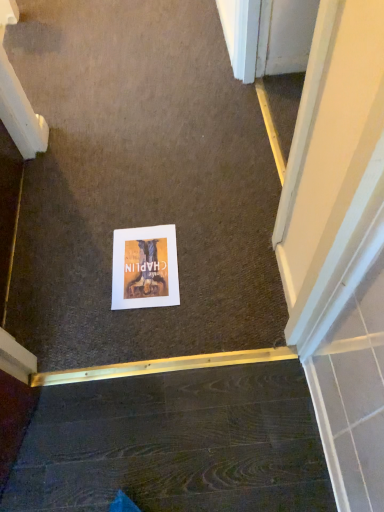
You are a GUI agent. You are given a task and a screenshot of the screen. Output one action in this format:
    pyautogui.click(x=<x>, y=<y>)
    Task: Click on the empty space that is ontop of white paper at center (from a real-world perspective)
    Image resolution: width=384 pixels, height=512 pixels.
    Given the screenshot: What is the action you would take?
    pyautogui.click(x=144, y=266)